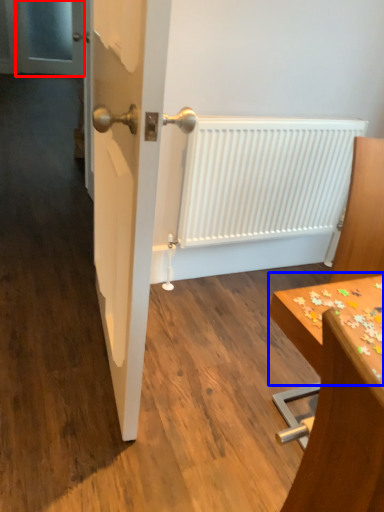
Question: Which object is closer to the camera taking this photo, screen door (highlighted by a red box) or table (highlighted by a blue box)?

Choices:
 (A) screen door
 (B) table

Answer: (B)